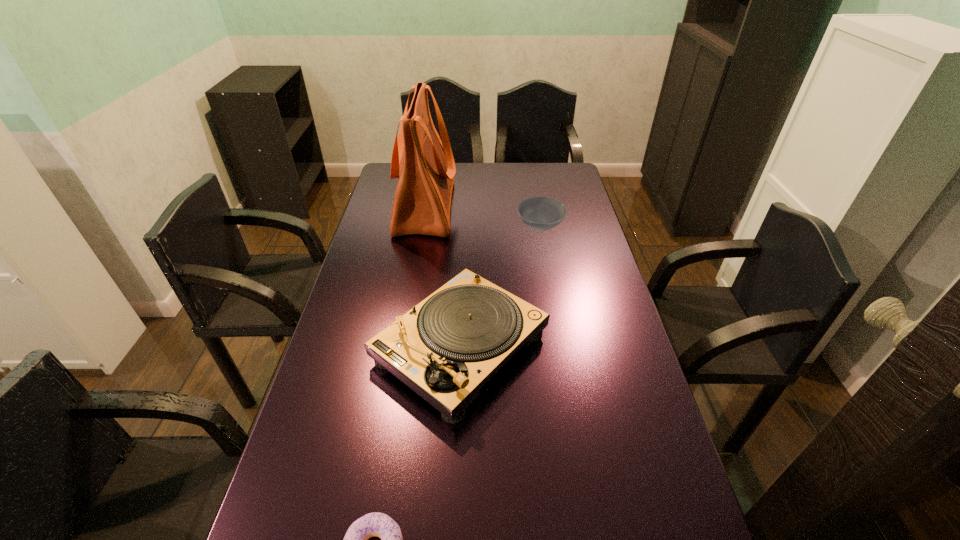
Locate an element on the screen. shopping bag is located at coordinates (426, 168).

Find the location of `the second nearest object`. the second nearest object is located at coordinates (445, 348).

At what (x,y) coordinates should I click in order to perform the action: click on record player. Please return your answer as a coordinate pair (x, y). This screenshot has width=960, height=540. Looking at the image, I should click on click(x=445, y=348).

Identify the location of the second shortest object. (538, 213).

Locate an element on the screen. free location located 0.280m on the front pocket of the tallest object is located at coordinates (528, 207).

Where is `vacant space located on the right of the record player`? vacant space located on the right of the record player is located at coordinates (572, 347).

Image resolution: width=960 pixels, height=540 pixels. Identify the location of vacant space located on the back of the bowl. (537, 207).

Find the location of a particular element. This screenshot has height=540, width=960. object that is at the far edge is located at coordinates (426, 168).

Locate an element on the screen. This screenshot has width=960, height=540. shopping bag at the left edge is located at coordinates (426, 168).

Image resolution: width=960 pixels, height=540 pixels. I want to click on record player that is at the left edge, so click(445, 348).